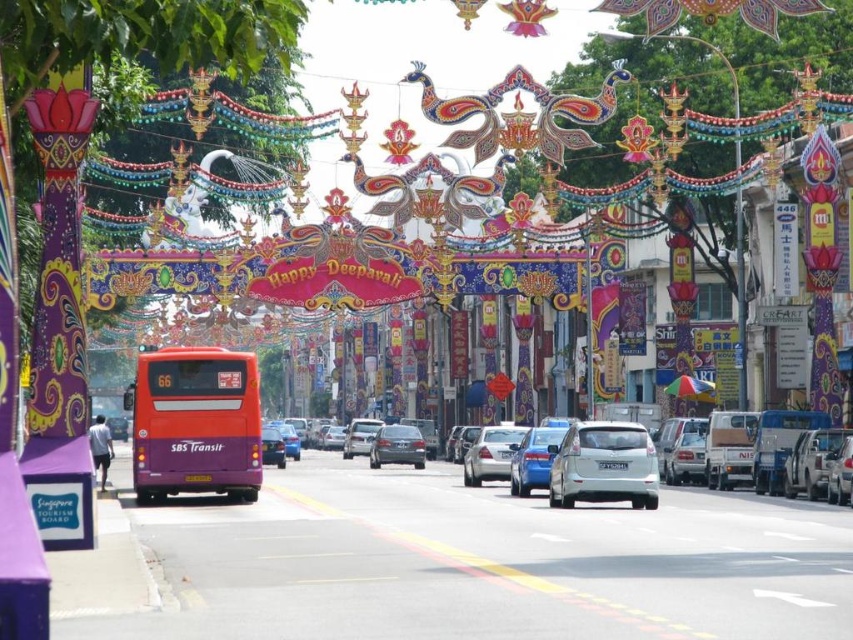
Question: Which point is closer to the camera taking this photo?

Choices:
 (A) (701, 515)
 (B) (155, 401)

Answer: (A)

Question: Can you confirm if white glossy sedan at center is thinner than satin silver sedan at center?

Choices:
 (A) yes
 (B) no

Answer: (B)

Question: Does orange matte bus at center have a greater width compared to satin silver sedan at center?

Choices:
 (A) yes
 (B) no

Answer: (A)

Question: Considering the real-world distances, which object is farthest from the silver metallic hatchback at center?

Choices:
 (A) satin silver sedan at center
 (B) white glossy sedan at center
 (C) orange matte bus at center

Answer: (A)

Question: Is the position of silver metallic hatchback at center less distant than that of satin silver sedan at center?

Choices:
 (A) no
 (B) yes

Answer: (B)

Question: Among these objects, which one is nearest to the camera?

Choices:
 (A) silver metallic hatchback at center
 (B) white glossy sedan at center

Answer: (B)